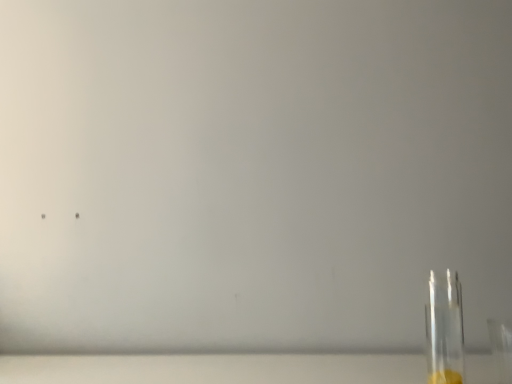
Question: Relative to transparent glass bottle at right, is transparent glass table at lower right in front or behind?

Choices:
 (A) front
 (B) behind

Answer: (B)

Question: From the image's perspective, is transparent glass table at lower right located above or below transparent glass bottle at right?

Choices:
 (A) above
 (B) below

Answer: (B)

Question: Based on their positions, is transparent glass table at lower right located to the left or right of transparent glass bottle at right?

Choices:
 (A) right
 (B) left

Answer: (B)

Question: Is transparent glass bottle at right inside or outside of transparent glass table at lower right?

Choices:
 (A) inside
 (B) outside

Answer: (B)

Question: From the image's perspective, is transparent glass bottle at right located above or below transparent glass table at lower right?

Choices:
 (A) below
 (B) above

Answer: (B)

Question: Looking at the image, does transparent glass bottle at right seem bigger or smaller compared to transparent glass table at lower right?

Choices:
 (A) big
 (B) small

Answer: (B)

Question: Is transparent glass bottle at right taller or shorter than transparent glass table at lower right?

Choices:
 (A) tall
 (B) short

Answer: (A)